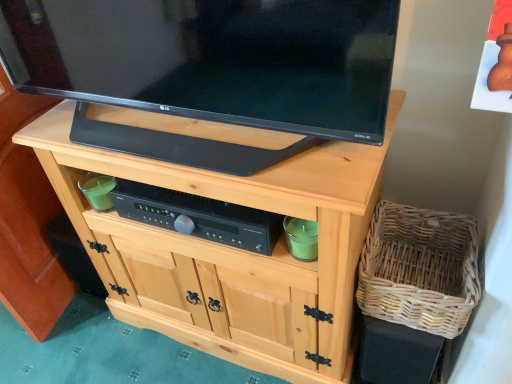
Question: From a real-world perspective, is black plastic control at center positioned above or below black glossy tv at upper center?

Choices:
 (A) below
 (B) above

Answer: (A)

Question: From the image's perspective, is black plastic control at center positioned above or below black glossy tv at upper center?

Choices:
 (A) above
 (B) below

Answer: (B)

Question: Based on their relative distances, which object is farther from the woven natural basket at lower right?

Choices:
 (A) black plastic control at center
 (B) natural wood cabinet at center
 (C) black glossy tv at upper center

Answer: (C)

Question: Considering the real-world distances, which object is closest to the natural wood cabinet at center?

Choices:
 (A) black glossy tv at upper center
 (B) black plastic control at center
 (C) woven natural basket at lower right

Answer: (B)